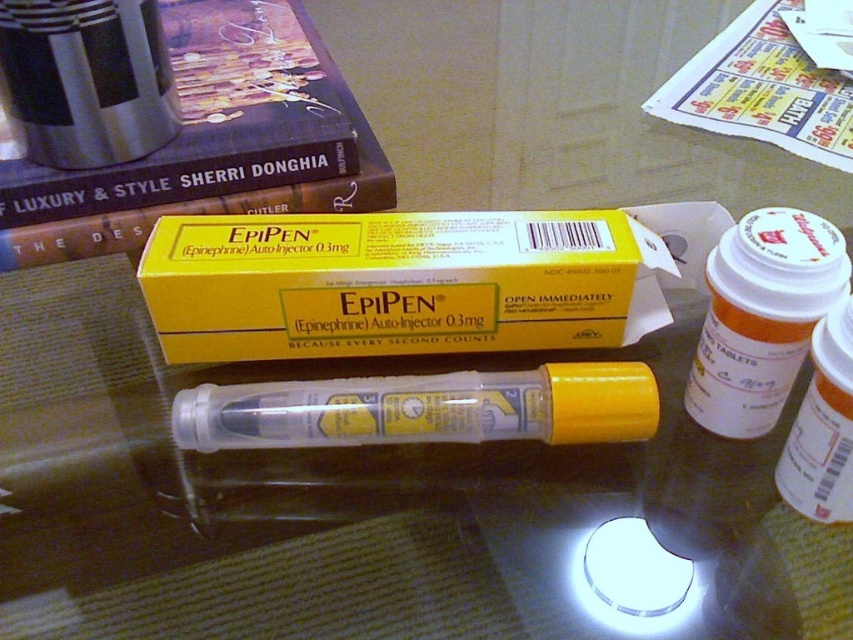
Question: Which point appears farthest from the camera in this image?

Choices:
 (A) (207, 204)
 (B) (585, 337)

Answer: (A)

Question: Can you confirm if yellow cardboard box at center is bigger than hardcover book at upper left?

Choices:
 (A) no
 (B) yes

Answer: (A)

Question: Is yellow cardboard box at center positioned in front of hardcover book at upper left?

Choices:
 (A) no
 (B) yes

Answer: (B)

Question: Is yellow cardboard box at center to the left of hardcover book at upper left from the viewer's perspective?

Choices:
 (A) yes
 (B) no

Answer: (B)

Question: Which point is closer to the camera taking this photo?

Choices:
 (A) (32, 227)
 (B) (521, 214)

Answer: (B)